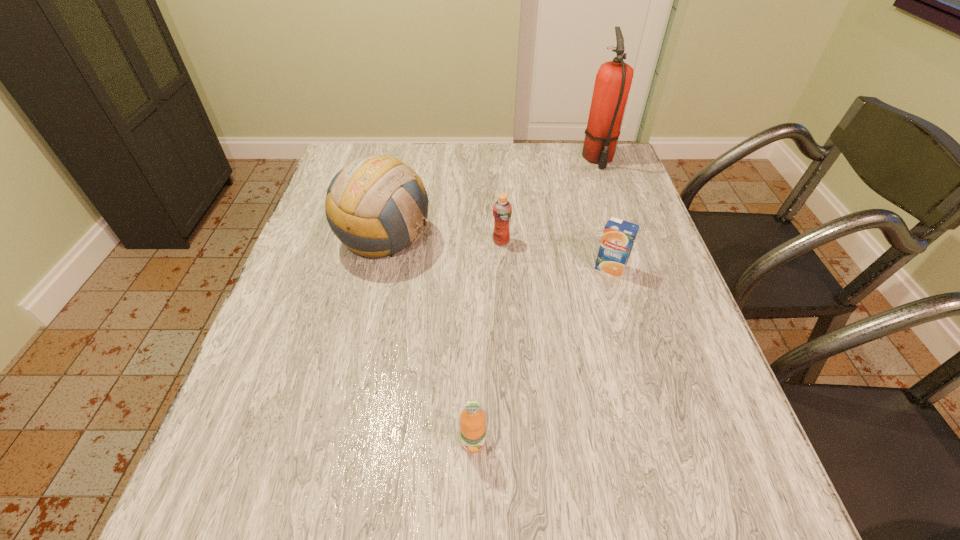
The image size is (960, 540). Find the location of `vacant area located 0.050m on the left of the fourth shortest object`. vacant area located 0.050m on the left of the fourth shortest object is located at coordinates (319, 240).

Find the location of a particular element. blank space located on the right of the farthest orange juice is located at coordinates (538, 241).

At what (x,y) coordinates should I click in order to perform the action: click on vacant area situated on the back of the rightmost orange juice. Please return your answer as a coordinate pair (x, y). Image resolution: width=960 pixels, height=540 pixels. Looking at the image, I should click on (586, 184).

You are a GUI agent. You are given a task and a screenshot of the screen. Output one action in this format:
    pyautogui.click(x=<x>, y=<y>)
    Task: Click on the free location located on the label of the nearest orange juice
    Image resolution: width=960 pixels, height=540 pixels.
    Given the screenshot: What is the action you would take?
    pyautogui.click(x=472, y=498)

The height and width of the screenshot is (540, 960). In order to click on object at the far edge in this screenshot , I will do 613,81.

I want to click on object at the left edge, so click(376, 205).

I want to click on fire extinguisher situated at the right edge, so click(613, 81).

Image resolution: width=960 pixels, height=540 pixels. Identify the location of orange_juice that is at the right edge. (618, 238).

Where is `object located in the far right corner section of the desktop`? object located in the far right corner section of the desktop is located at coordinates (613, 81).

Image resolution: width=960 pixels, height=540 pixels. In order to click on vacant space at the far edge of the desktop in this screenshot , I will do `click(528, 160)`.